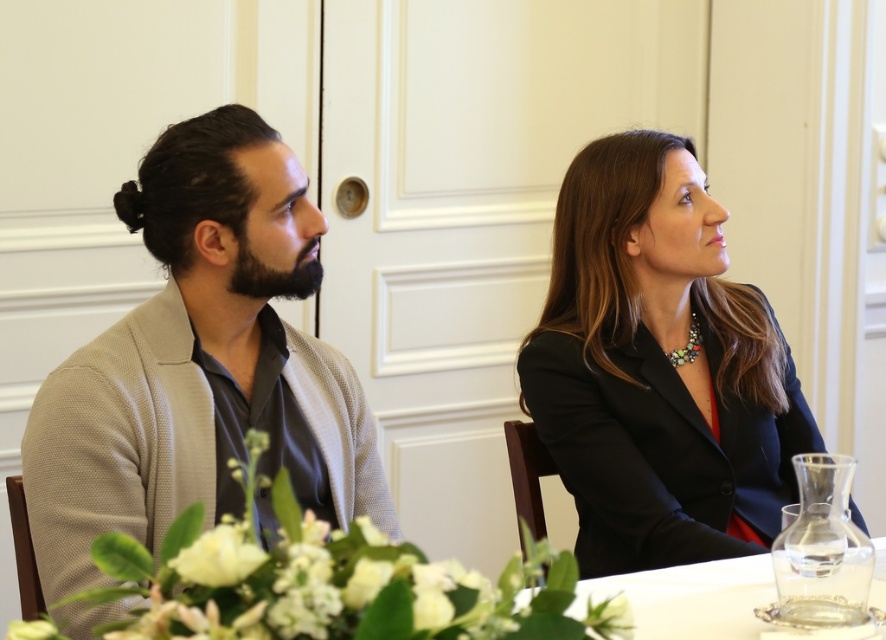
Does point (246, 170) lie behind point (685, 541)?

No, it is not.

Find the location of `beige textured cardigan at left`. beige textured cardigan at left is located at coordinates (200, 364).

Between point (76, 552) and point (662, 156), which one is positioned in front?

Point (76, 552) is more forward.

Locate an element on the screen. beige textured cardigan at left is located at coordinates (200, 364).

Who is more distant from viewer, (807, 413) or (663, 612)?

Positioned behind is point (807, 413).

Who is positioned more to the left, matte black blazer at center or clear glass water at lower center?

Positioned to the left is matte black blazer at center.

Locate an element on the screen. This screenshot has width=886, height=640. matte black blazer at center is located at coordinates (658, 369).

You are a GUI agent. You are given a task and a screenshot of the screen. Output one action in this format:
    pyautogui.click(x=<x>, y=<y>)
    Task: Click on the matte black blazer at center
    
    Given the screenshot: What is the action you would take?
    pyautogui.click(x=658, y=369)

Looking at this image, between beige textured cardigan at left and clear glass water at lower center, which one is positioned higher?

beige textured cardigan at left

Is beige textured cardigan at left positioned at the back of clear glass water at lower center?

Yes, beige textured cardigan at left is behind clear glass water at lower center.

Is point (216, 122) farther from viewer compared to point (750, 616)?

Yes.

At what (x,y) coordinates should I click in order to perform the action: click on beige textured cardigan at left. Please return your answer as a coordinate pair (x, y). Looking at the image, I should click on (200, 364).